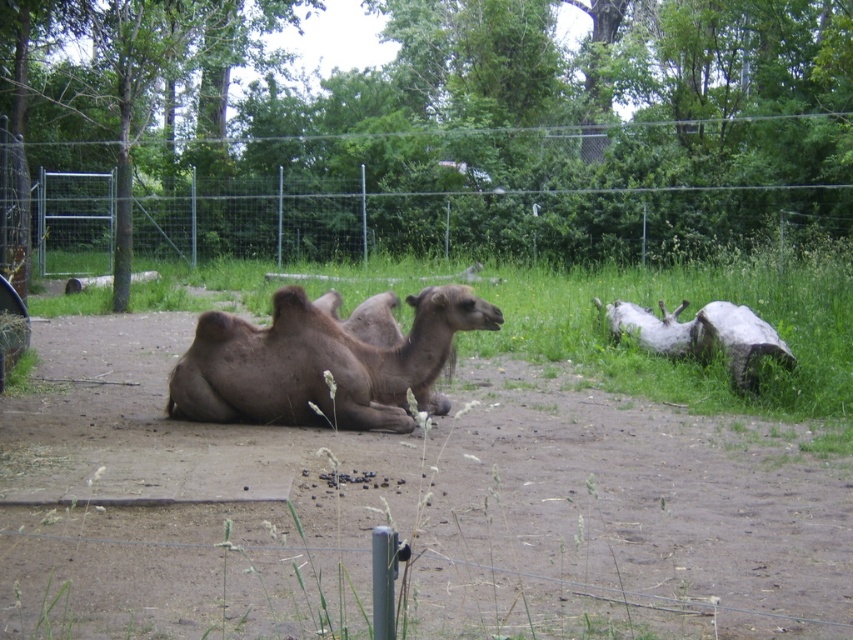
Question: Which of the following is the farthest from the observer?

Choices:
 (A) brown rough wood at right
 (B) metallic wire fence at upper center
 (C) brown rough camel at center

Answer: (B)

Question: Can you confirm if metallic wire fence at upper center is positioned to the left of brown rough camel at center?

Choices:
 (A) no
 (B) yes

Answer: (A)

Question: Which object is the farthest from the brown matte camel at center?

Choices:
 (A) metallic wire fence at upper center
 (B) brown rough camel at center

Answer: (A)

Question: Among these objects, which one is farthest from the camera?

Choices:
 (A) brown rough wood at right
 (B) brown matte camel at center

Answer: (A)

Question: Where is brown rough wood at right located in relation to brown rough camel at center in the image?

Choices:
 (A) below
 (B) above

Answer: (A)

Question: Does metallic wire fence at upper center lie behind brown matte camel at center?

Choices:
 (A) yes
 (B) no

Answer: (A)